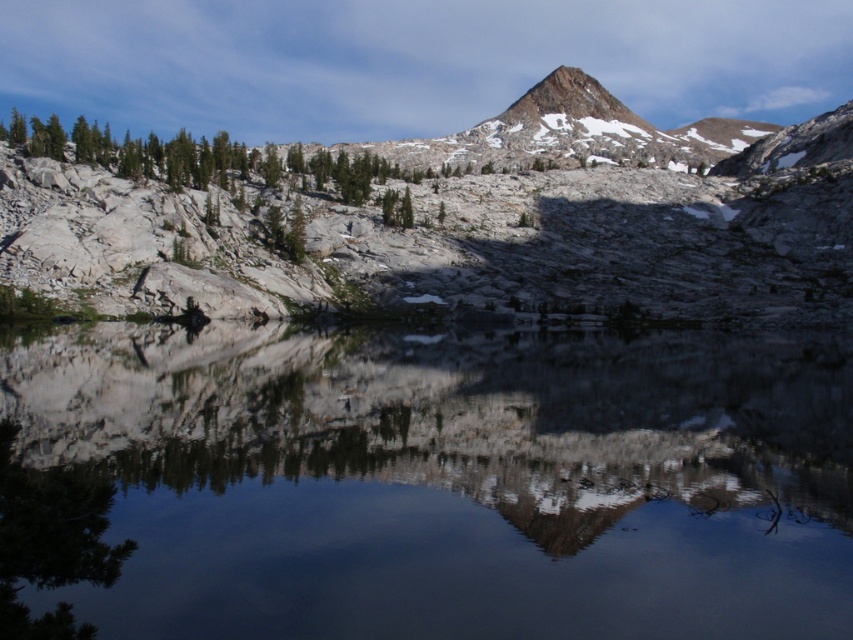
You are a hiker standing at the point marked as point (425, 483) in the image. You want to cross the smooth reflective water at center to reach the mountains in the background. Is the water at your current location suitable for walking on?

The smooth reflective water at center is located at point (425, 483), so the water is exactly where you are standing. Since water is not solid ground, you cannot walk on it. You should find another path around the water to reach the mountains.

You are standing at the edge of the mountain lake and see two points in the water. The first point is at coordinates point (45, 486) and the second point is at point (78, 502). Which point is closer to your position?

Point (45, 486) is further to the camera than point (78, 502), so the point closer to your position is point (78, 502).